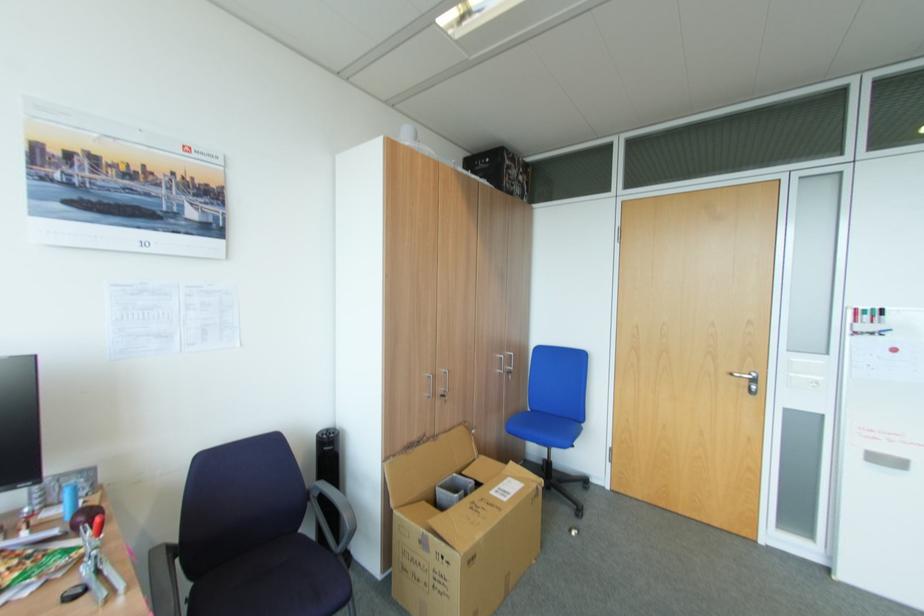
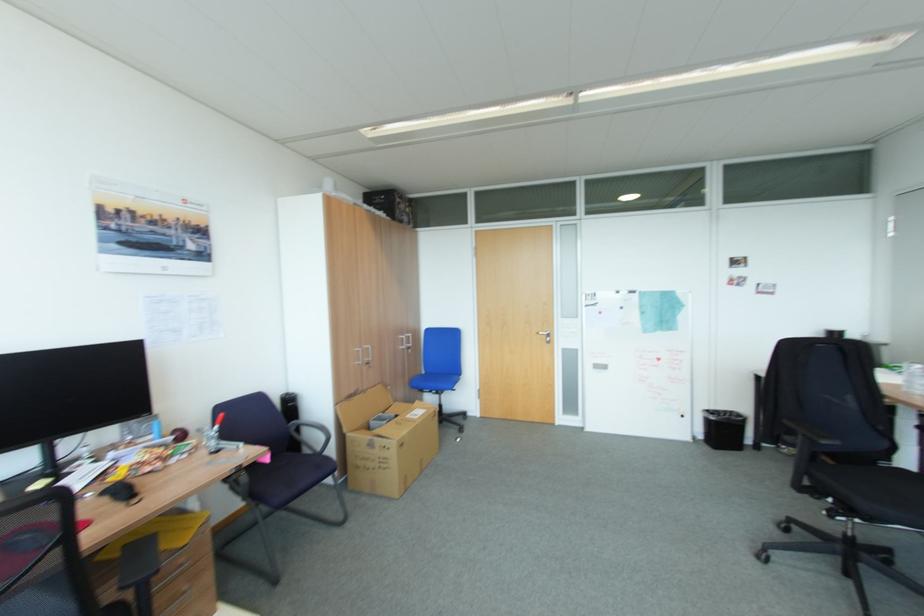
Locate, in the second image, the point that corresponds to point 445,390 in the first image.

(371, 360)